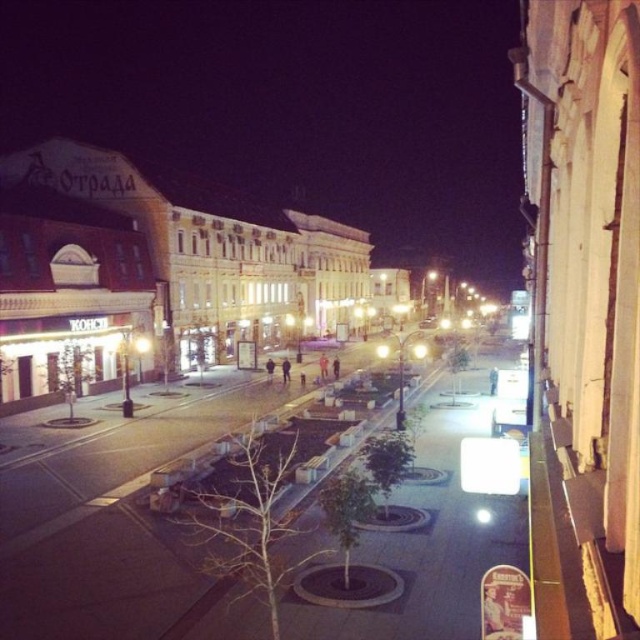
You are a city planner assessing the space between the smooth concrete benches at center and the white painted building at left. Which object is wider?

The smooth concrete benches at center has a lesser width compared to the white painted building at left, so the white painted building at left is wider.

You are standing on the balcony of the building on the right side of the street. You see a point marked at coordinates (124, 518). What object is located at that point?

The point at coordinates (124, 518) marks smooth concrete benches at center.

You are a city planner reviewing this urban scene. You need to determine if the smooth concrete benches at center can be seen from the top of the white painted building at left. Based on their heights, can you confirm this?

The smooth concrete benches at center is not as tall as white painted building at left, so the benches can be seen from the top of the white painted building at left since they are shorter and would not obstruct the view.